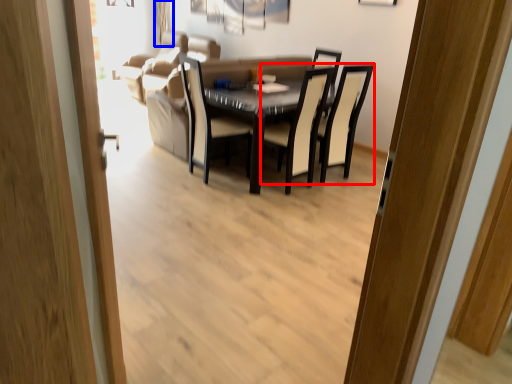
Question: Among these objects, which one is nearest to the camera, chair (highlighted by a red box) or curtain (highlighted by a blue box)?

Choices:
 (A) chair
 (B) curtain

Answer: (A)